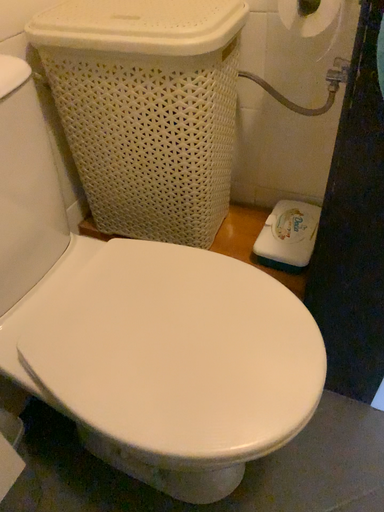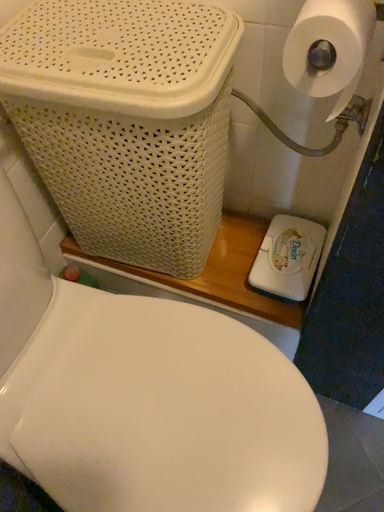
Question: How did the camera likely rotate when shooting the video?

Choices:
 (A) rotated downward
 (B) rotated upward

Answer: (A)